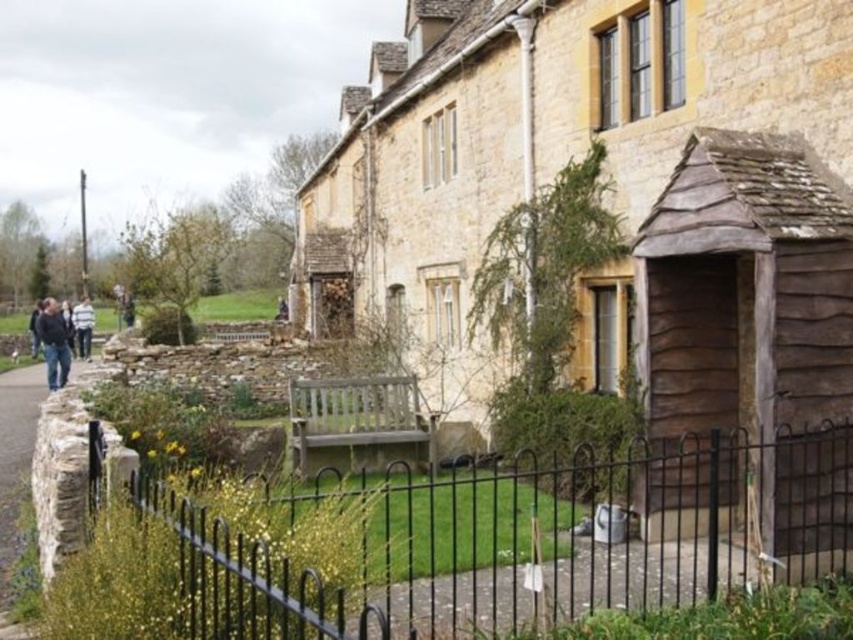
Is black wrought iron fence at lower center shorter than dark blue jacket at left?

Correct, black wrought iron fence at lower center is not as tall as dark blue jacket at left.

Is point (637, 548) more distant than point (36, 320)?

No, it is in front of (36, 320).

Which is in front, point (846, 554) or point (33, 330)?

Point (846, 554) is more forward.

Where is `black wrought iron fence at lower center`? black wrought iron fence at lower center is located at coordinates (526, 540).

Which of these two, black wrought iron fence at lower center or dark blue jeans at left, stands taller?

dark blue jeans at left

Between black wrought iron fence at lower center and dark blue jeans at left, which one has less height?

With less height is black wrought iron fence at lower center.

Does point (195, 637) lie in front of point (39, 317)?

Yes.

Locate an element on the screen. black wrought iron fence at lower center is located at coordinates (526, 540).

Is point (369, 289) farther from viewer compared to point (738, 397)?

Yes, it is behind point (738, 397).

Is wooden shed at center-right behind wooden shingles shed at lower right?

Yes, wooden shed at center-right is behind wooden shingles shed at lower right.

Does point (364, 198) lie in front of point (722, 244)?

No, it is not.

The width and height of the screenshot is (853, 640). What are the coordinates of `wooden shed at center-right` in the screenshot? It's located at (613, 193).